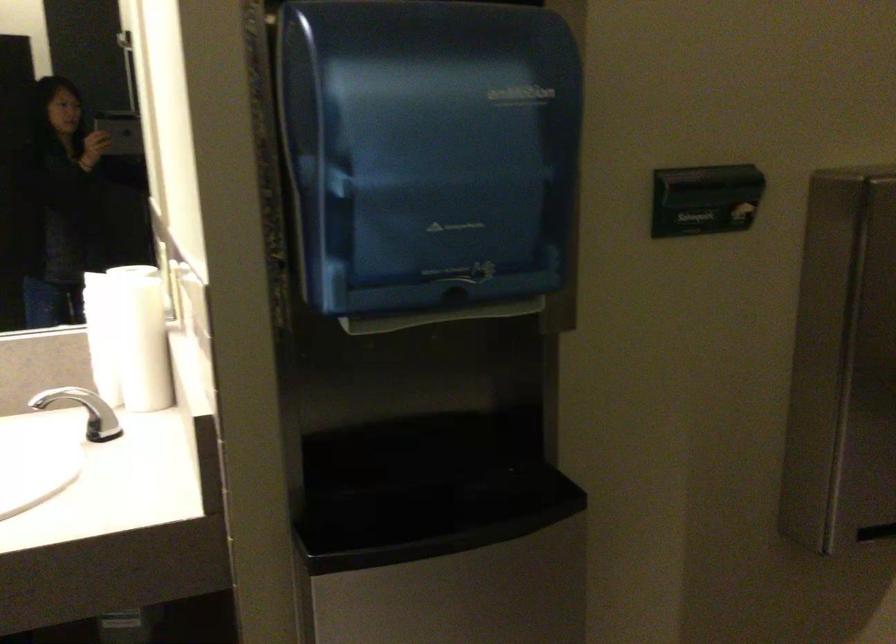
Locate an element on the screen. The width and height of the screenshot is (896, 644). waste bin opening is located at coordinates (446, 561).